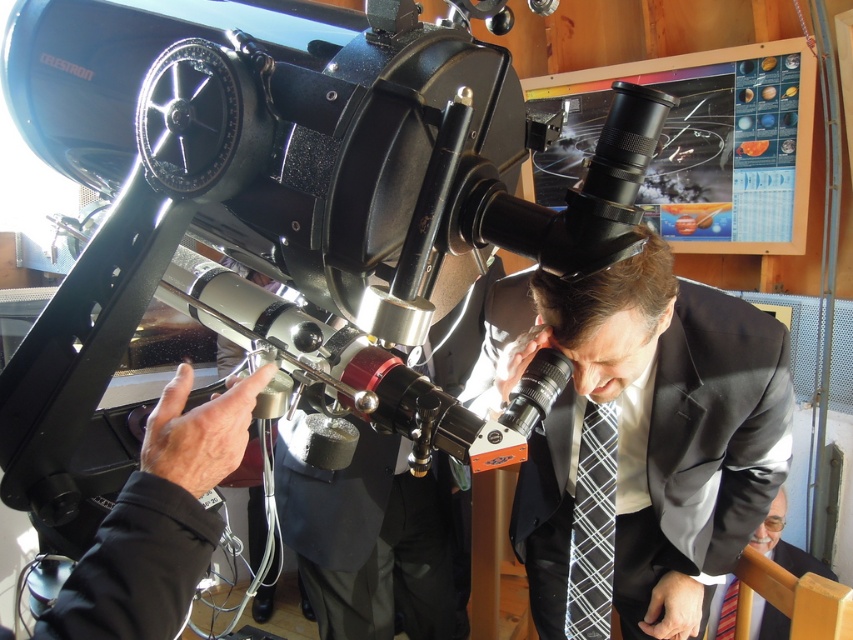
Question: Which point is farther from the camera taking this photo?

Choices:
 (A) (596, 516)
 (B) (732, 627)

Answer: (B)

Question: Among these points, which one is nearest to the camera?

Choices:
 (A) (527, 465)
 (B) (734, 608)

Answer: (A)

Question: Considering the relative positions of dark gray suit at center and black checkered tie at lower right in the image provided, where is dark gray suit at center located with respect to black checkered tie at lower right?

Choices:
 (A) left
 (B) right

Answer: (B)

Question: Does black checkered tie at lower right appear under striped fabric tie at lower right?

Choices:
 (A) no
 (B) yes

Answer: (A)

Question: Considering the real-world distances, which object is closest to the white shirt at center?

Choices:
 (A) black silk business suit at center
 (B) dark gray suit at center
 (C) black checkered tie at lower right

Answer: (B)

Question: Can you confirm if dark gray suit at center is positioned below black checkered tie at lower right?

Choices:
 (A) yes
 (B) no

Answer: (B)